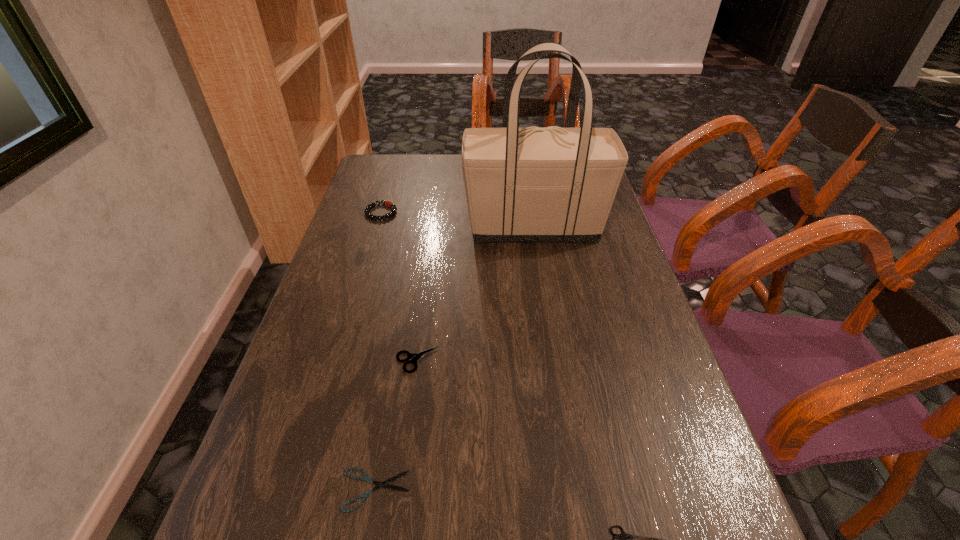
Identify the location of vacant point located between the shortest object and the bracelet. This screenshot has height=540, width=960. (378, 351).

Locate an element on the screen. The height and width of the screenshot is (540, 960). vacant area between the shortest shears and the second tallest object is located at coordinates (378, 351).

Where is `object that is the fourth nearest to the bracelet`? This screenshot has height=540, width=960. object that is the fourth nearest to the bracelet is located at coordinates (624, 539).

At what (x,y) coordinates should I click in order to perform the action: click on object that stands as the closest to the nearest shears. Please return your answer as a coordinate pair (x, y). This screenshot has width=960, height=540. Looking at the image, I should click on tap(366, 478).

Identify which shears is located as the second nearest to the nearest object. Please provide its 2D coordinates. Your answer should be formatted as a tuple, i.e. [(x, y)], where the tuple contains the x and y coordinates of a point satisfying the conditions above.

[(414, 357)]

Locate an element on the screen. shears that stands as the second closest to the nearest object is located at coordinates (414, 357).

Locate an element on the screen. Image resolution: width=960 pixels, height=540 pixels. free location that satisfies the following two spatial constraints: 1. with handles facing forward on the tallest object; 2. on the front side of the third nearest object is located at coordinates (555, 361).